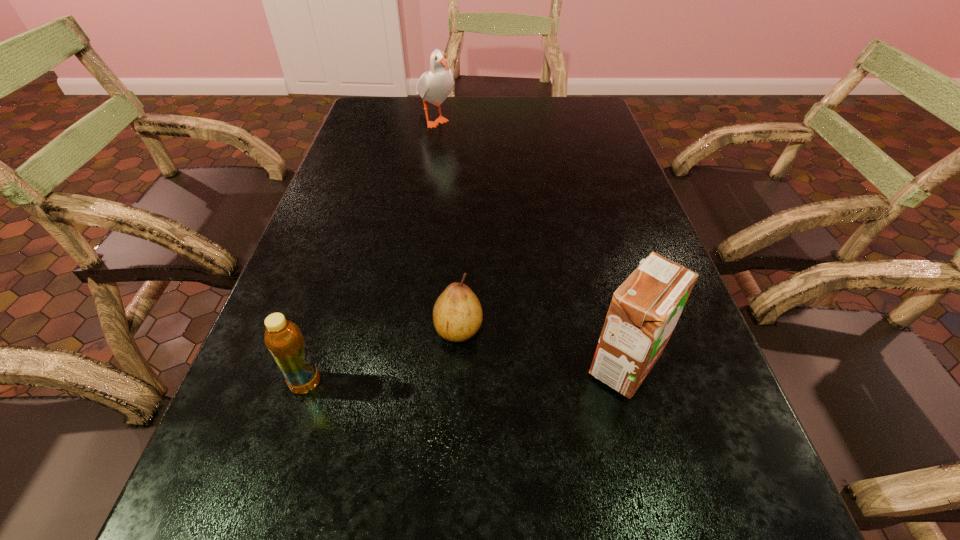
Identify the location of free spot located on the right of the shortest object. (553, 329).

The width and height of the screenshot is (960, 540). Identify the location of object located at the far edge. (434, 86).

The image size is (960, 540). In order to click on object located at the left edge in this screenshot , I will do `click(283, 338)`.

The width and height of the screenshot is (960, 540). I want to click on object that is at the right edge, so click(x=645, y=308).

What are the coordinates of `free space at the far edge of the desktop` in the screenshot? It's located at (545, 106).

At what (x,y) coordinates should I click in order to perform the action: click on vacant space at the left edge of the desktop. Please return your answer as a coordinate pair (x, y). This screenshot has height=540, width=960. Looking at the image, I should click on (389, 160).

Identify the location of vacant region at the right edge of the desktop. The width and height of the screenshot is (960, 540). (584, 156).

Locate an element on the screen. The height and width of the screenshot is (540, 960). free location at the far right corner is located at coordinates click(x=579, y=127).

I want to click on free area in between the gull and the shortest object, so click(x=446, y=224).

Find the location of `vacant area between the third tallest object and the gull`. vacant area between the third tallest object and the gull is located at coordinates pos(371,251).